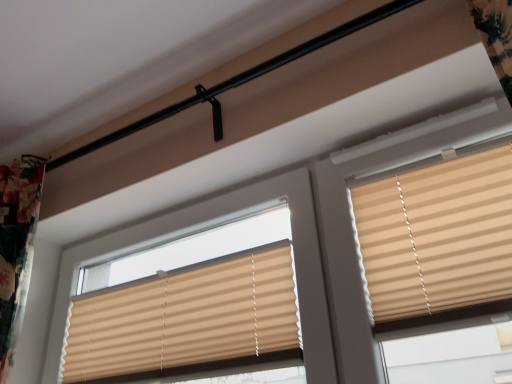
Question: Is beige pleated blinds at upper right, the second window blind from the left, in front of or behind beige pleated blind at center, placed as the 2th window blind when sorted from right to left, in the image?

Choices:
 (A) front
 (B) behind

Answer: (A)

Question: From the image's perspective, is beige pleated blinds at upper right, acting as the first window blind starting from the right, located above or below beige pleated blind at center, placed as the 2th window blind when sorted from right to left?

Choices:
 (A) below
 (B) above

Answer: (B)

Question: Based on their sizes in the image, would you say beige pleated blinds at upper right, the second window blind from the left, is bigger or smaller than beige pleated blind at center, marked as the 1th window blind in a left-to-right arrangement?

Choices:
 (A) small
 (B) big

Answer: (A)

Question: Looking at their shapes, would you say beige pleated blind at center, placed as the 2th window blind when sorted from right to left, is wider or thinner than beige pleated blinds at upper right, the second window blind from the left?

Choices:
 (A) thin
 (B) wide

Answer: (A)

Question: In terms of height, does beige pleated blind at center, marked as the 1th window blind in a left-to-right arrangement, look taller or shorter compared to beige pleated blinds at upper right, acting as the first window blind starting from the right?

Choices:
 (A) short
 (B) tall

Answer: (A)

Question: From the image's perspective, is beige pleated blind at center, placed as the 2th window blind when sorted from right to left, above or below beige pleated blinds at upper right, acting as the first window blind starting from the right?

Choices:
 (A) below
 (B) above

Answer: (A)

Question: In terms of size, does beige pleated blind at center, marked as the 1th window blind in a left-to-right arrangement, appear bigger or smaller than beige pleated blinds at upper right, the second window blind from the left?

Choices:
 (A) big
 (B) small

Answer: (A)